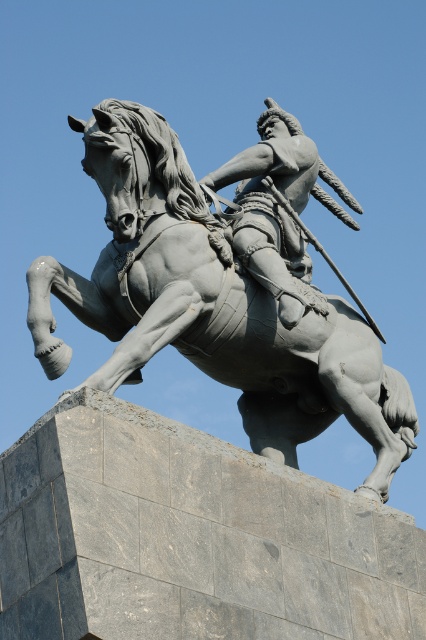
You are standing at the base of the statue and want to place a small flower bouquet between the gray stone statue at center and the polished bronze rider at center. Is there enough space to place it there?

The gray stone statue at center and polished bronze rider at center are 3.51 meters apart, so yes, there is enough space to place a small flower bouquet between them.

You are an art student analyzing the statue. You observe the gray stone statue at center and the polished bronze rider at center. Which object is bigger in size?

The gray stone statue at center is larger in size than the polished bronze rider at center.

You are standing in front of the statue and want to place a small flower bouquet between the gray stone statue at center and the polished bronze rider at center. Which object should you place the bouquet closer to if you want it to be closer to the left side of the scene?

The gray stone statue at center is to the left of the polished bronze rider at center, so placing the bouquet closer to the gray stone statue at center will position it nearer to the left side of the scene.